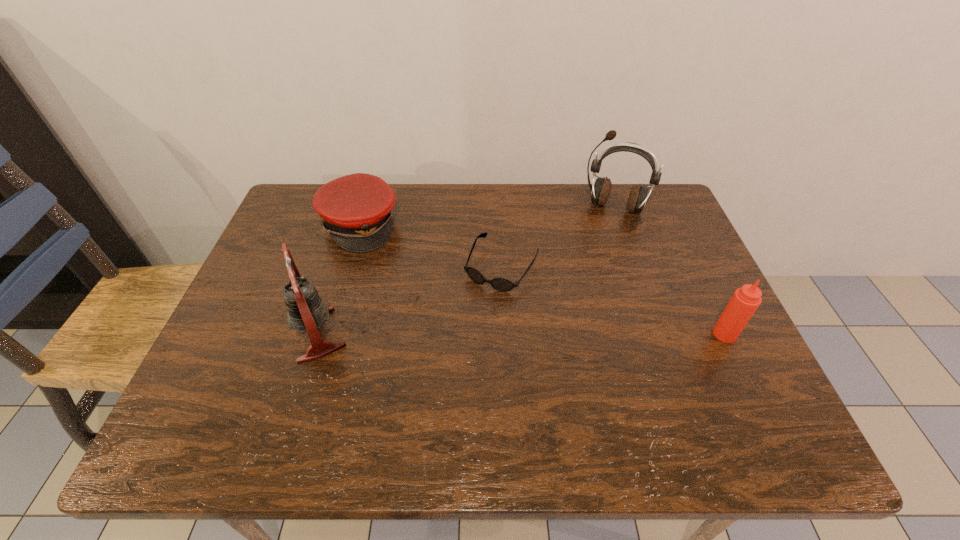
Find the location of a particular element. Image resolution: width=960 pixels, height=540 pixels. free point between the fourth object from left to right and the Tabasco sauce is located at coordinates (670, 271).

At what (x,y) coordinates should I click in order to perform the action: click on free space between the bell and the shortest object. Please return your answer as a coordinate pair (x, y). The image size is (960, 540). Looking at the image, I should click on pos(409,301).

Locate an element on the screen. object that stands as the second closest to the shortest object is located at coordinates (357, 209).

Point out which object is positioned as the nearest to the fourth object from left to right. Please provide its 2D coordinates. Your answer should be formatted as a tuple, i.e. [(x, y)], where the tuple contains the x and y coordinates of a point satisfying the conditions above.

[(500, 284)]

Find the location of a particular element. The height and width of the screenshot is (540, 960). blank space that satisfies the following two spatial constraints: 1. on the front side of the third shortest object; 2. on the left side of the sunglasses is located at coordinates (505, 334).

What are the coordinates of `vacant region that satisfies the following two spatial constraints: 1. on the back side of the second object from right to left; 2. on the left side of the bell` in the screenshot? It's located at (357, 207).

What are the coordinates of `free spot that satisfies the following two spatial constraints: 1. on the front side of the sunglasses; 2. on the right side of the second shortest object` in the screenshot? It's located at (348, 267).

The height and width of the screenshot is (540, 960). Identify the location of vacant space that satisfies the following two spatial constraints: 1. on the front side of the earphone; 2. on the left side of the rightmost object. (660, 334).

Where is `vacant space that satisfies the following two spatial constraints: 1. on the back side of the second object from right to left; 2. on the right side of the bell`? vacant space that satisfies the following two spatial constraints: 1. on the back side of the second object from right to left; 2. on the right side of the bell is located at coordinates coord(357,207).